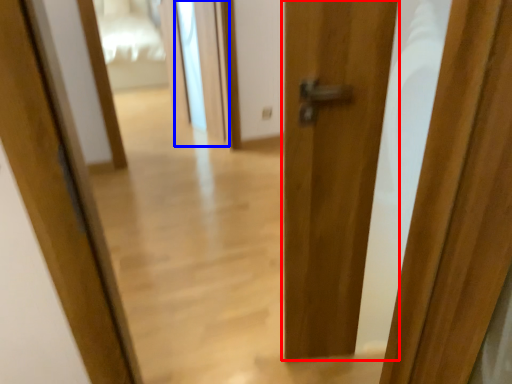
Question: Which point is closer to the camera, door (highlighted by a red box) or screen door (highlighted by a blue box)?

Choices:
 (A) door
 (B) screen door

Answer: (A)